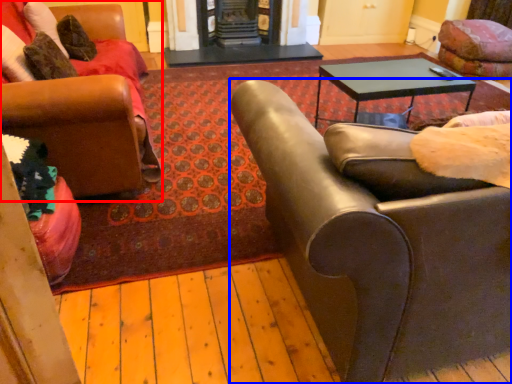
Question: Which object is closer to the camera taking this photo, chair (highlighted by a red box) or chair (highlighted by a blue box)?

Choices:
 (A) chair
 (B) chair

Answer: (B)